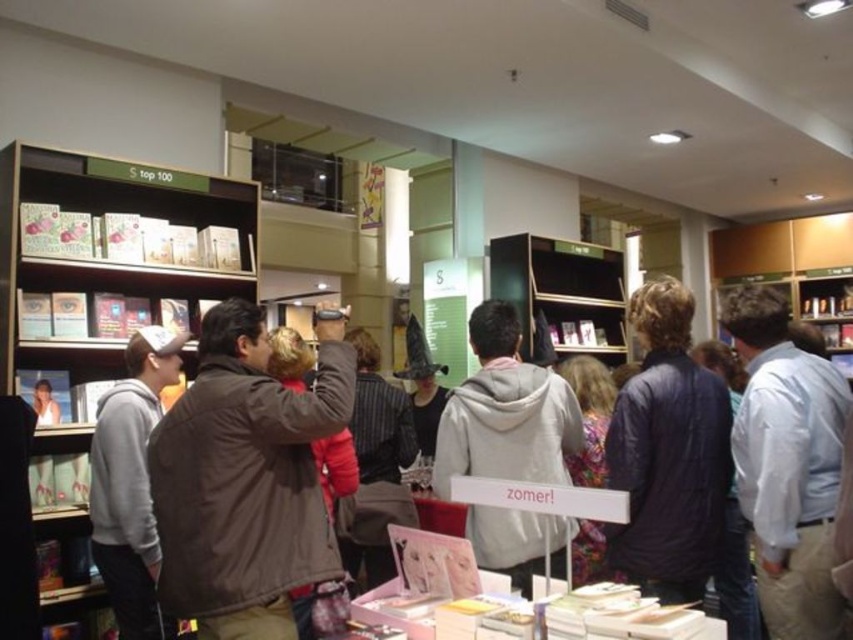
Question: Where is wooden bookshelf at left located in relation to dark blue jacket at center in the image?

Choices:
 (A) below
 (B) above

Answer: (B)

Question: Is brown leather jacket at center above wooden bookshelf at left?

Choices:
 (A) no
 (B) yes

Answer: (A)

Question: Does wooden bookshelf at left appear on the right side of metallic silver bookshelf at center?

Choices:
 (A) yes
 (B) no

Answer: (B)

Question: Among these points, which one is nearest to the camera?

Choices:
 (A) (651, 460)
 (B) (152, 196)
 (C) (596, 381)
 (D) (500, 387)

Answer: (A)

Question: Which point is farther from the camera taking this photo?

Choices:
 (A) (212, 316)
 (B) (575, 576)
 (C) (129, 474)
 (D) (114, 172)

Answer: (D)

Question: Which of the following is the farthest from the observer?

Choices:
 (A) light blue shirt at center
 (B) striped fabric jacket at center

Answer: (B)